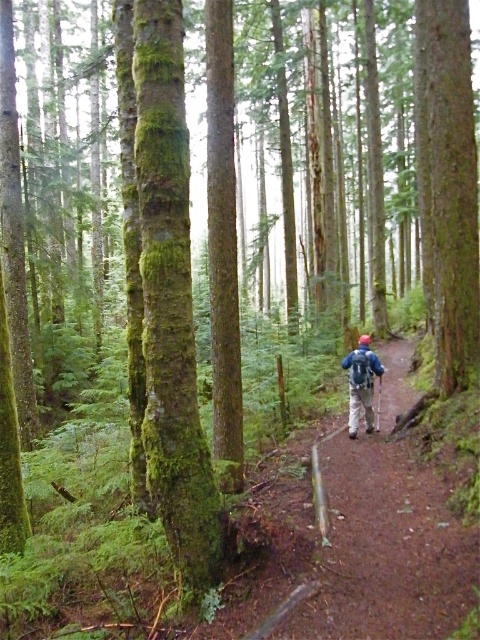
You are a hiker who has just spotted both the green mossy tree trunk at center and the blue matte jacket at center in the forest. Which object is closer to you according to the scene?

The green mossy tree trunk at center is closer because it is positioned in front of the blue matte jacket at center, indicating it is nearer to the observer.

You are a hiker who has just noticed a blue fabric backpack at center and a green mossy tree trunk at center in your path. Which object is positioned to the left when facing the direction you are walking?

The green mossy tree trunk at center is to the left of the blue fabric backpack at center, so when facing forward, the green mossy tree trunk at center would be on the left side.